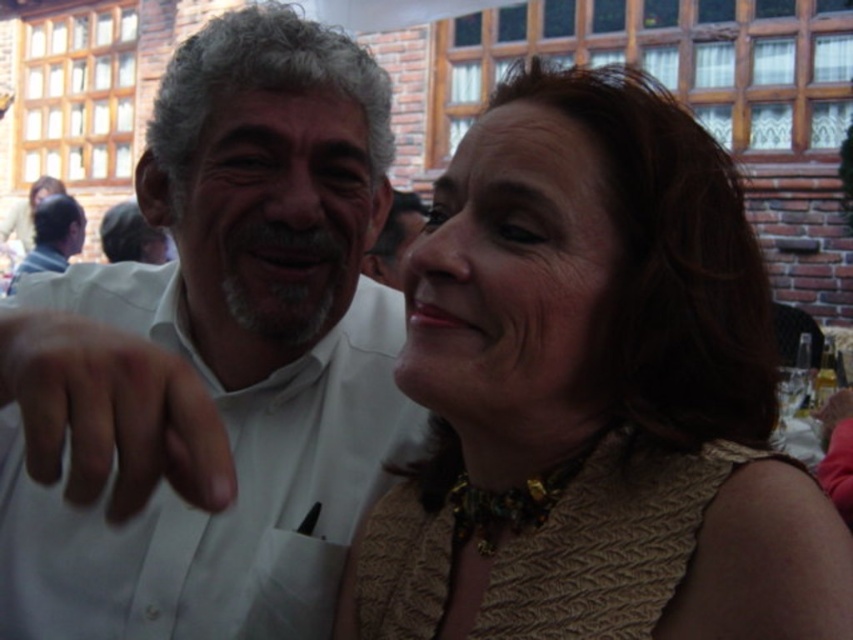
Is gold textured dress at center to the left of matte white shirt at left from the viewer's perspective?

In fact, gold textured dress at center is to the right of matte white shirt at left.

This screenshot has height=640, width=853. What do you see at coordinates (593, 394) in the screenshot?
I see `gold textured dress at center` at bounding box center [593, 394].

Identify the location of gold textured dress at center. The image size is (853, 640). point(593,394).

Locate an element on the screen. The width and height of the screenshot is (853, 640). white matte hand at center is located at coordinates (111, 413).

Is the position of white matte hand at center less distant than that of matte white shirt at left?

Yes, it is.

Is point (73, 428) farther from camera compared to point (48, 225)?

No, (73, 428) is in front of (48, 225).

This screenshot has height=640, width=853. In order to click on white matte hand at center in this screenshot , I will do `click(111, 413)`.

The width and height of the screenshot is (853, 640). What do you see at coordinates (593, 394) in the screenshot?
I see `gold textured dress at center` at bounding box center [593, 394].

Identify the location of gold textured dress at center. (593, 394).